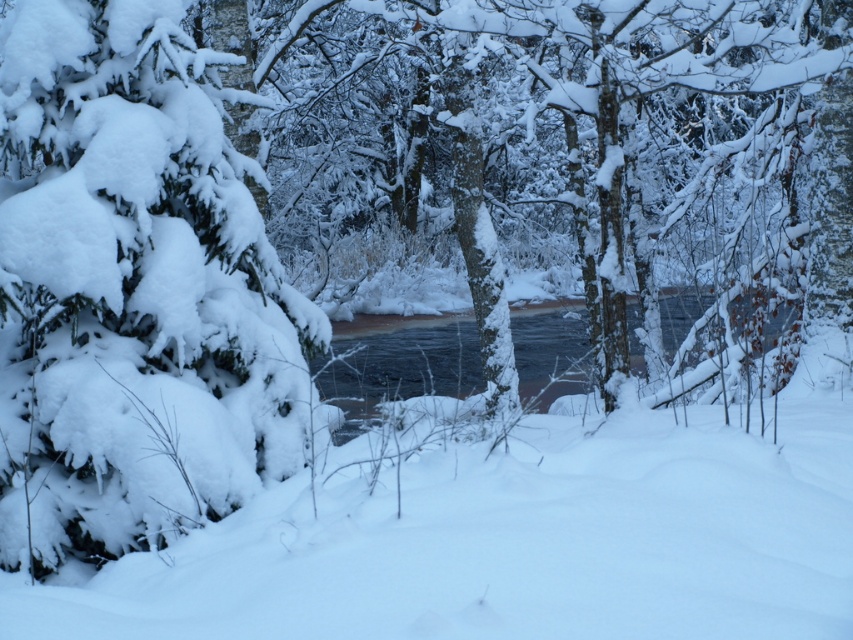
You are an observer in the winter forest scene. You notice two areas of white fluffy snow at center and white fluffy snow at left. Which area of snow has a bigger size?

The white fluffy snow at center is larger in size than the white fluffy snow at left.

You are an explorer trying to cross the forest. You see the white fluffy snow at center and the clear water at center. Which surface is lower in height?

The white fluffy snow at center has a lesser height compared to clear water at center, so the white fluffy snow at center is lower in height.

You are standing in the winter forest scene and want to walk from the point closer to you to the point further away. Which path would you take between the two points, point(235,429) and point(675,304)?

You should take the path from point(235,429) to point(675,304) because point(235,429) is closer to the viewer and you want to move towards the point(675,304) which is further away.